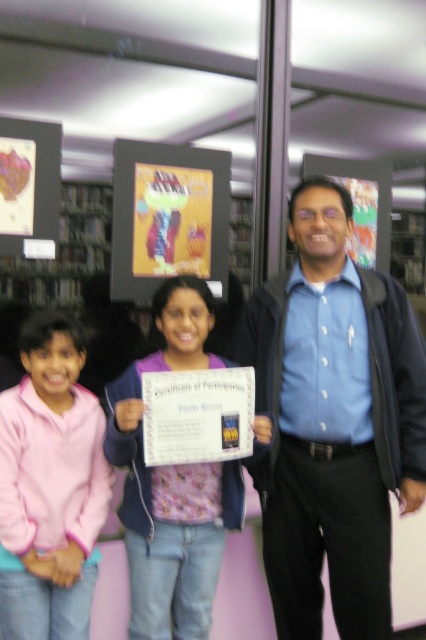
Does blue shirt at center have a lesser height compared to pink fleece jacket at lower left?

No, blue shirt at center is not shorter than pink fleece jacket at lower left.

Is blue shirt at center above pink fleece jacket at lower left?

Yes.

This screenshot has width=426, height=640. I want to click on blue shirt at center, so click(333, 420).

Find the location of `blue shirt at center`. blue shirt at center is located at coordinates (333, 420).

Between blue shirt at center and pink fabric shirt at center, which one is positioned lower?

Positioned lower is pink fabric shirt at center.

Who is taller, blue shirt at center or pink fabric shirt at center?

blue shirt at center is taller.

At what (x,y) coordinates should I click in order to perform the action: click on blue shirt at center. Please return your answer as a coordinate pair (x, y). This screenshot has height=640, width=426. Looking at the image, I should click on (333, 420).

At what (x,y) coordinates should I click in order to perform the action: click on blue shirt at center. Please return your answer as a coordinate pair (x, y). Image resolution: width=426 pixels, height=640 pixels. Looking at the image, I should click on (333, 420).

Is pink fleece jacket at lower left above pink fabric shirt at center?

Actually, pink fleece jacket at lower left is below pink fabric shirt at center.

Which is below, pink fleece jacket at lower left or pink fabric shirt at center?

Positioned lower is pink fleece jacket at lower left.

Who is more forward, (40, 332) or (198, 346)?

Point (40, 332)

You are a GUI agent. You are given a task and a screenshot of the screen. Output one action in this format:
    pyautogui.click(x=<x>, y=<y>)
    Task: Click on the pink fleece jacket at lower left
    
    Given the screenshot: What is the action you would take?
    pyautogui.click(x=49, y=486)